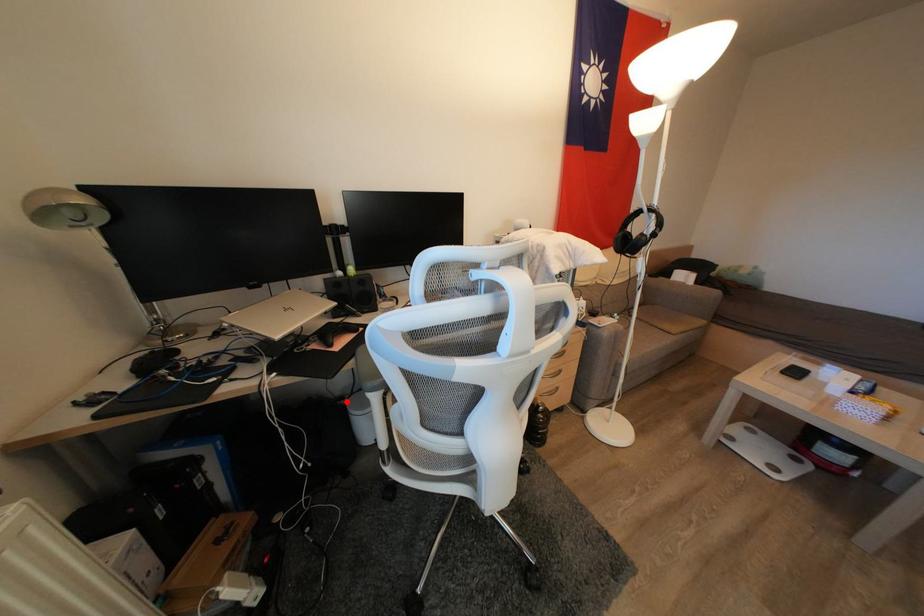
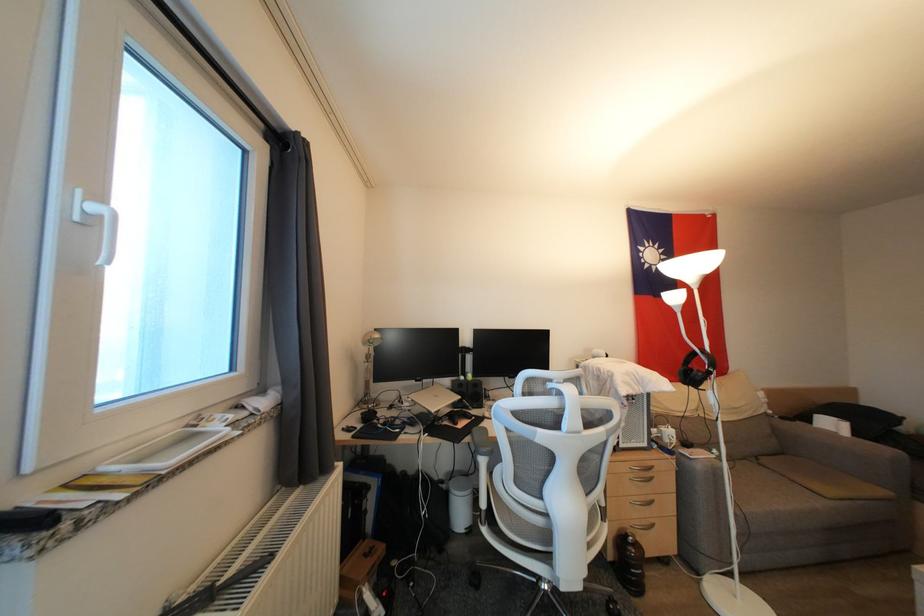
Where in the second image is the point corresponding to the highlighted location from the first image?

(447, 485)